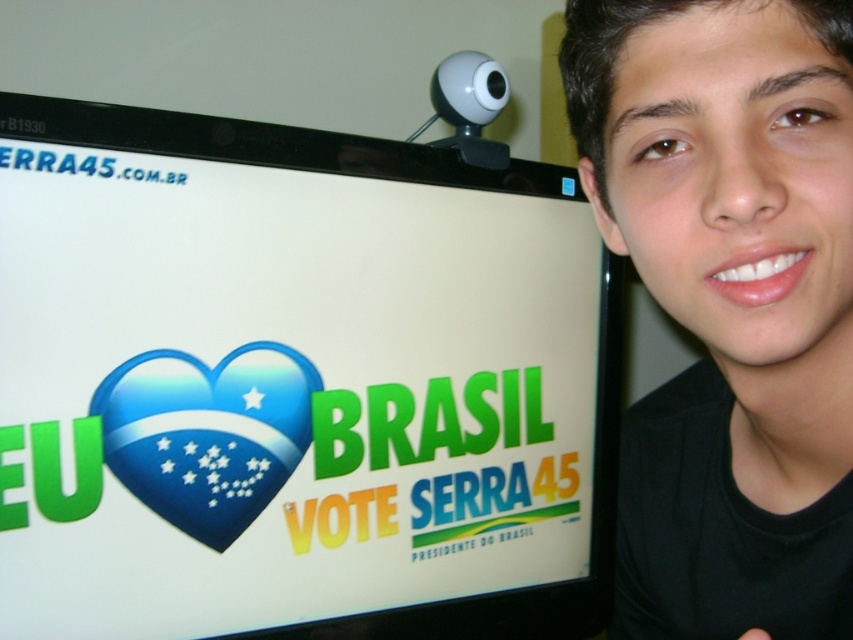
Which of these two, white glossy computer screen at upper center or black matte face at upper right, stands taller?

Standing taller between the two is black matte face at upper right.

From the picture: Between white glossy computer screen at upper center and black matte face at upper right, which one is positioned higher?

Answer: Positioned higher is white glossy computer screen at upper center.

Who is more distant from viewer, (492,253) or (744,509)?

Positioned behind is point (492,253).

Locate an element on the screen. The image size is (853, 640). white glossy computer screen at upper center is located at coordinates (294, 384).